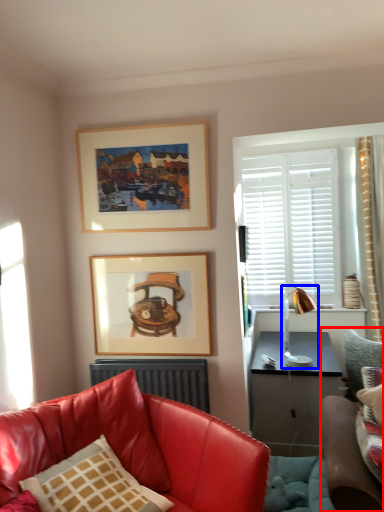
Question: Which of the following is the closest to the observer, studio couch (highlighted by a red box) or lamp (highlighted by a blue box)?

Choices:
 (A) studio couch
 (B) lamp

Answer: (A)